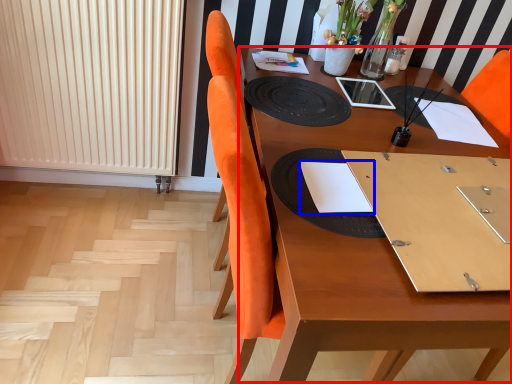
Question: Which of the following is the farthest to the observer, round table (highlighted by a red box) or notebook (highlighted by a blue box)?

Choices:
 (A) round table
 (B) notebook

Answer: (B)